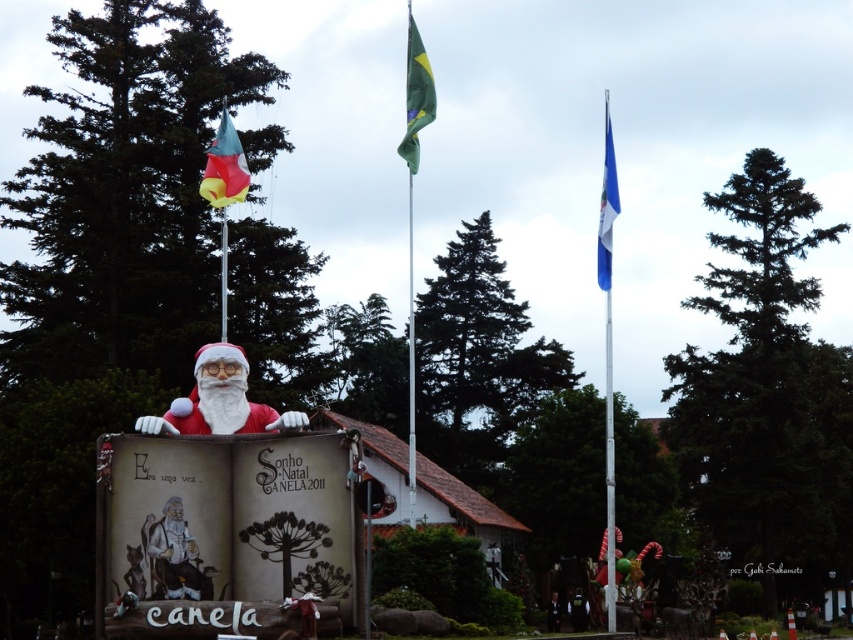
Does matte red santa at center appear on the left side of matte plastic flag at upper left?

No, matte red santa at center is not to the left of matte plastic flag at upper left.

Between matte red santa at center and matte plastic flag at upper left, which one is positioned higher?

matte plastic flag at upper left is above.

Identify the location of matte red santa at center. (219, 401).

Can you confirm if matte red santa at center is shorter than blue fabric flag at right?

Yes.

Does matte red santa at center lie in front of blue fabric flag at right?

Yes, it is.

The width and height of the screenshot is (853, 640). In order to click on matte red santa at center in this screenshot , I will do `click(219, 401)`.

Does white metallic flag pole at right appear on the right side of matte plastic flag at upper left?

Indeed, white metallic flag pole at right is positioned on the right side of matte plastic flag at upper left.

Which is below, white metallic flag pole at right or matte plastic flag at upper left?

white metallic flag pole at right

Does point (612, 470) lie in front of point (222, 120)?

That is True.

Image resolution: width=853 pixels, height=640 pixels. Identify the location of white metallic flag pole at right. (608, 346).